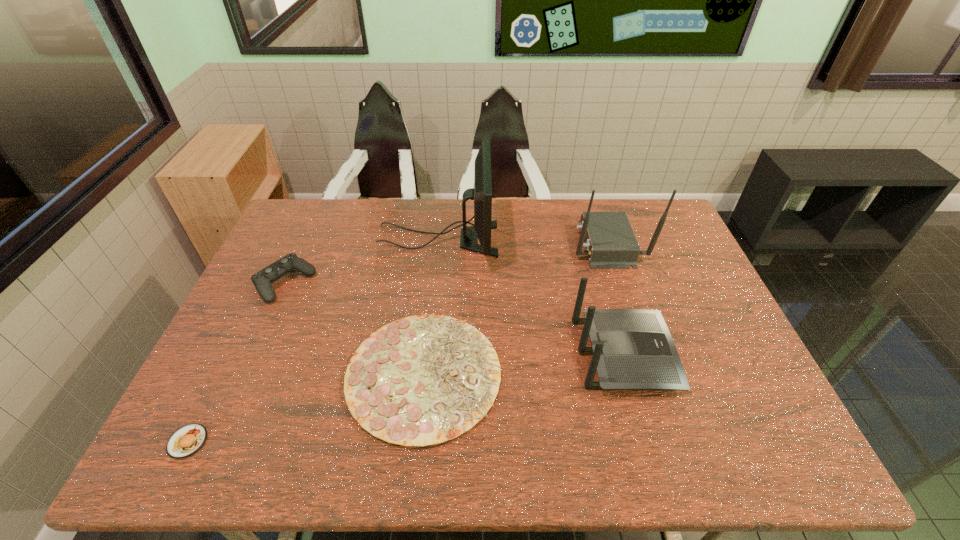
The width and height of the screenshot is (960, 540). I want to click on patty at the left edge, so click(186, 441).

Find the location of a particular element. Image resolution: width=960 pixels, height=540 pixels. object positioned at the right edge is located at coordinates (610, 242).

The width and height of the screenshot is (960, 540). I want to click on object that is positioned at the near left corner, so click(186, 441).

Where is `object that is at the far right corner`? This screenshot has width=960, height=540. object that is at the far right corner is located at coordinates tap(610, 242).

I want to click on vacant space at the near edge of the desktop, so click(588, 463).

Identify the location of free location at the left edge. This screenshot has width=960, height=540. (240, 324).

The height and width of the screenshot is (540, 960). I want to click on vacant space at the right edge, so point(676,333).

In the image, there is a desktop. Where is `vacant space at the far left corner`? vacant space at the far left corner is located at coordinates (284, 222).

Find the location of a particular element. The width and height of the screenshot is (960, 540). vacant space at the near left corner of the desktop is located at coordinates (225, 433).

The image size is (960, 540). In order to click on free location at the far right corner of the desktop in this screenshot , I will do `click(683, 239)`.